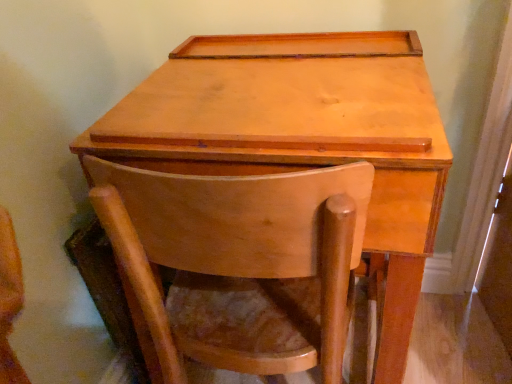
Identify the location of vacant region above matte wood chair at center (from a real-world perspective). Image resolution: width=512 pixels, height=384 pixels. (228, 142).